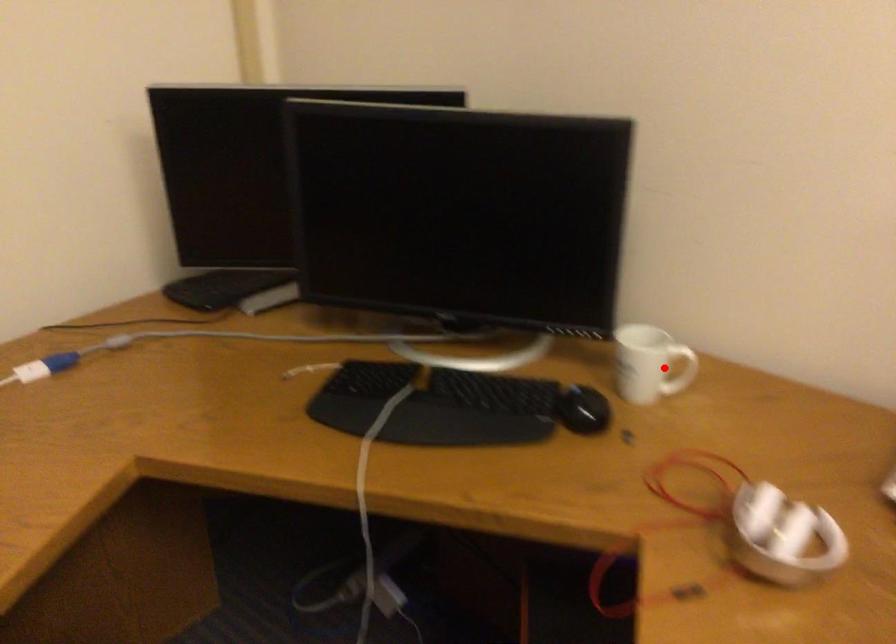
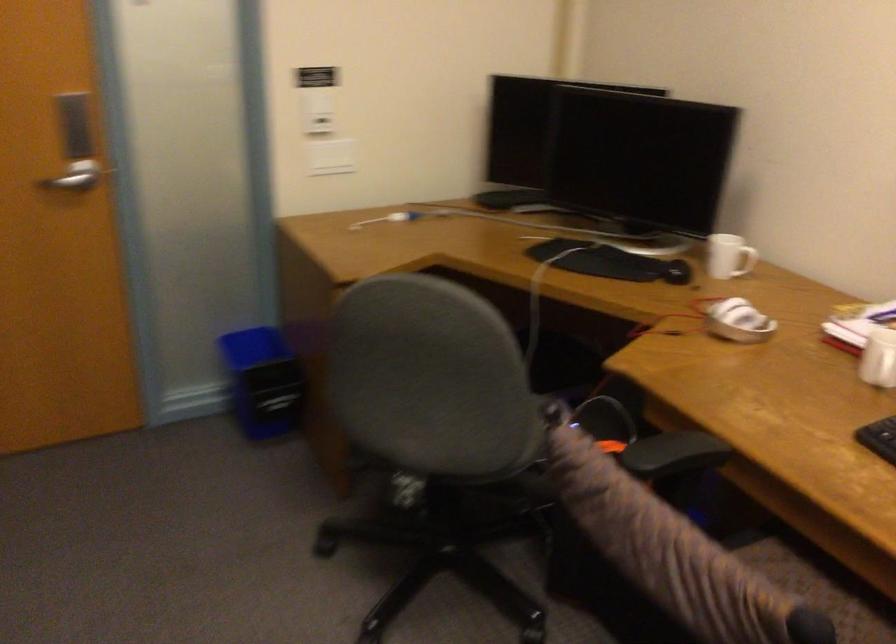
Locate, in the second image, the point that corresponds to the highlighted location in the first image.

(745, 261)